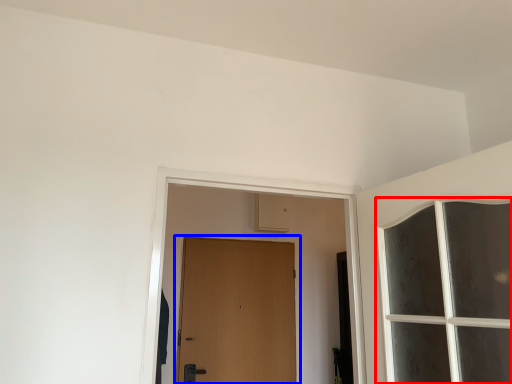
Question: Which of the following is the closest to the observer, window (highlighted by a red box) or door (highlighted by a blue box)?

Choices:
 (A) window
 (B) door

Answer: (A)